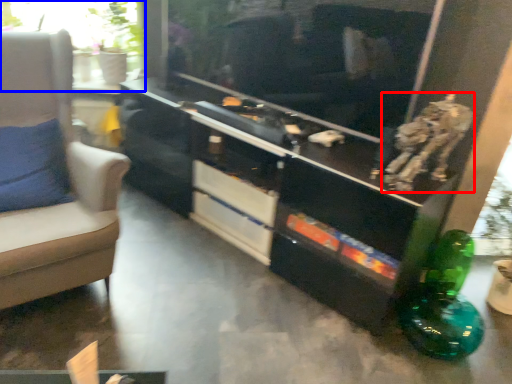
Question: Which object appears farthest to the camera in this image, animal (highlighted by a red box) or window (highlighted by a blue box)?

Choices:
 (A) animal
 (B) window

Answer: (B)